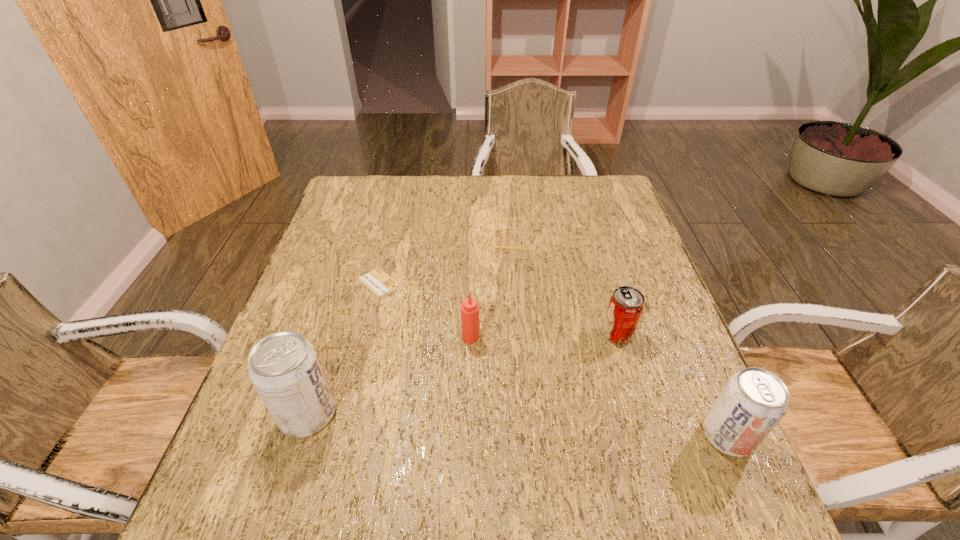
In order to click on object that is the nearest to the rightmost object in this screenshot , I will do `click(626, 304)`.

Locate an element on the screen. This screenshot has height=540, width=960. the second closest object relative to the Tabasco sauce is located at coordinates click(495, 220).

This screenshot has width=960, height=540. I want to click on pop soda that can be found as the closest to the leftmost pop soda, so click(626, 304).

Where is `pop soda object that ranks as the second closest to the tallest pop soda`? The height and width of the screenshot is (540, 960). pop soda object that ranks as the second closest to the tallest pop soda is located at coordinates (754, 400).

Locate an element on the screen. The width and height of the screenshot is (960, 540). free space that satisfies the following two spatial constraints: 1. in front of the lenses of the spectacles; 2. on the front side of the Tabasco sauce is located at coordinates (521, 337).

Identify the location of free space that satisfies the following two spatial constraints: 1. in front of the lenses of the fifth tallest object; 2. on the left side of the second shortest pop soda. (530, 435).

Identify the location of vacant space that satisfies the following two spatial constraints: 1. in front of the lenses of the fourth object from left to right; 2. on the left side of the fourth tallest object. Image resolution: width=960 pixels, height=540 pixels. pyautogui.click(x=520, y=333).

Where is `free space that satisfies the following two spatial constraints: 1. in front of the lenses of the fourth object from left to right; 2. on the front side of the second farthest object`? The height and width of the screenshot is (540, 960). free space that satisfies the following two spatial constraints: 1. in front of the lenses of the fourth object from left to right; 2. on the front side of the second farthest object is located at coordinates (516, 282).

Locate an element on the screen. This screenshot has height=540, width=960. free spot that satisfies the following two spatial constraints: 1. on the front side of the second tallest pop soda; 2. on the right side of the shortest object is located at coordinates 342,435.